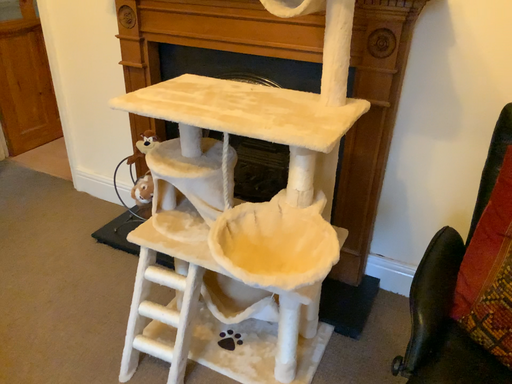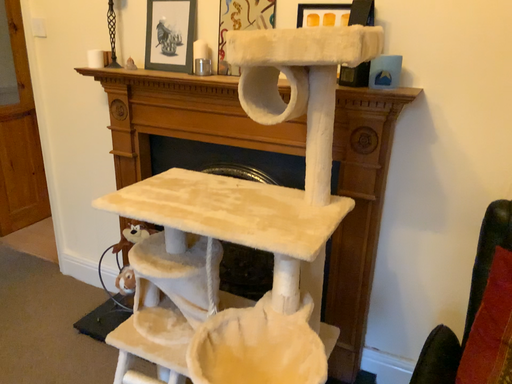
Question: How did the camera likely rotate when shooting the video?

Choices:
 (A) rotated upward
 (B) rotated downward

Answer: (A)